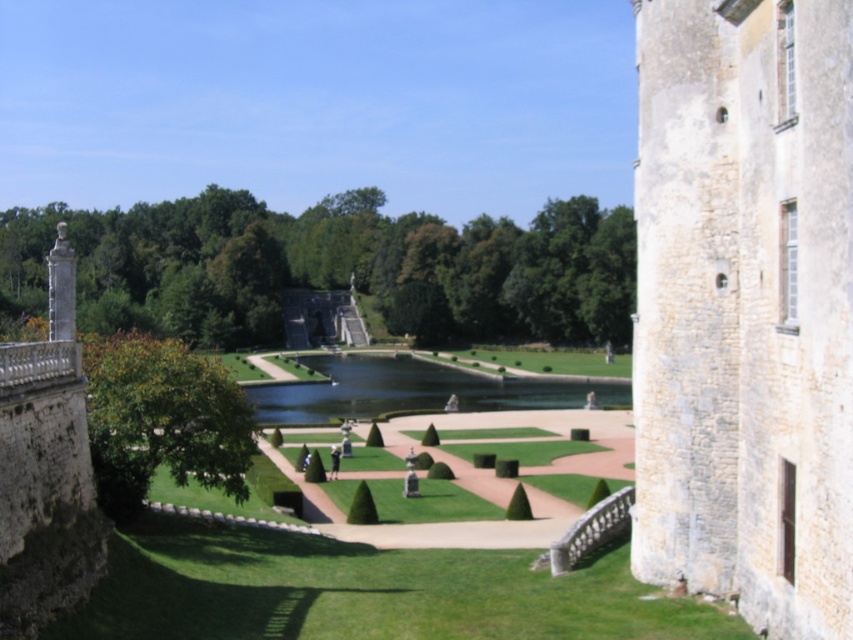
Question: Can you confirm if stone tower at right is positioned above green shrubbery at center?

Choices:
 (A) no
 (B) yes

Answer: (A)

Question: Which point is farther from the camera taking this photo?

Choices:
 (A) (645, 0)
 (B) (149, 460)
 (C) (380, 262)
 (D) (397, 356)

Answer: (C)

Question: Which of these objects is positioned farthest from the stone tower at right?

Choices:
 (A) green shrubbery at center
 (B) green leafy hedge at lower left

Answer: (A)

Question: Is stone tower at right behind green shrubbery at center?

Choices:
 (A) no
 (B) yes

Answer: (A)

Question: Which object is positioned farthest from the green shrubbery at center?

Choices:
 (A) green grassy lake at center
 (B) green leafy hedge at lower left

Answer: (B)

Question: Can you confirm if green shrubbery at center is bigger than green leafy hedge at lower left?

Choices:
 (A) no
 (B) yes

Answer: (B)